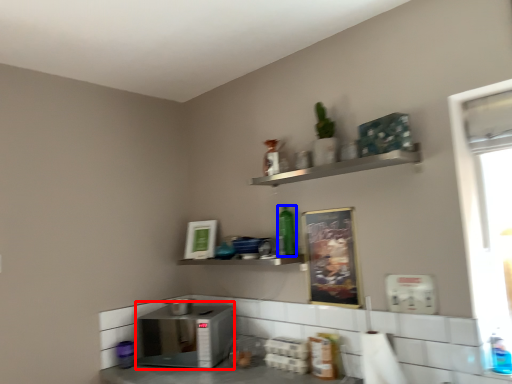
Question: Among these objects, which one is nearest to the camera, appliance (highlighted by a red box) or bottle (highlighted by a blue box)?

Choices:
 (A) appliance
 (B) bottle

Answer: (A)